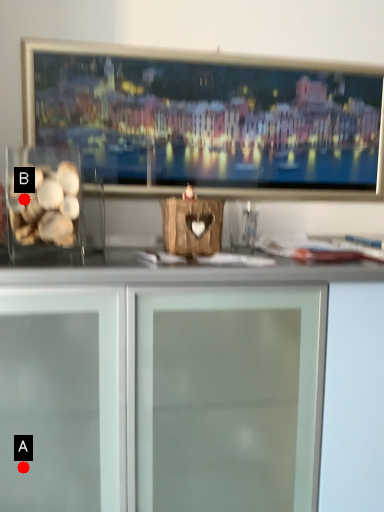
Question: Two points are circled on the image, labeled by A and B beside each circle. Which of the following is the farthest from the observer?

Choices:
 (A) A is further
 (B) B is further

Answer: (B)